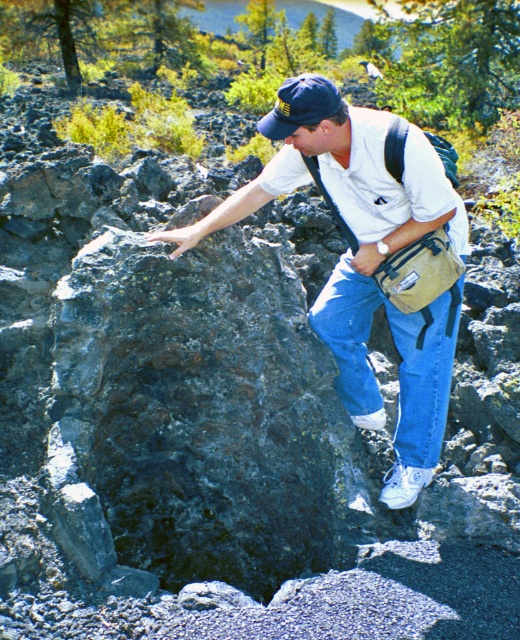
Question: Among these objects, which one is farthest from the camera?

Choices:
 (A) blue fabric baseball cap at center
 (B) white cotton shirt at center

Answer: (B)

Question: In this image, where is white cotton shirt at center located relative to blue fabric baseball cap at center?

Choices:
 (A) above
 (B) below

Answer: (B)

Question: Which of the following is the farthest from the observer?

Choices:
 (A) (287, 99)
 (B) (344, 198)

Answer: (B)

Question: Does white cotton shirt at center have a larger size compared to blue fabric baseball cap at center?

Choices:
 (A) no
 (B) yes

Answer: (A)

Question: Is white cotton shirt at center positioned at the back of blue fabric baseball cap at center?

Choices:
 (A) yes
 (B) no

Answer: (A)